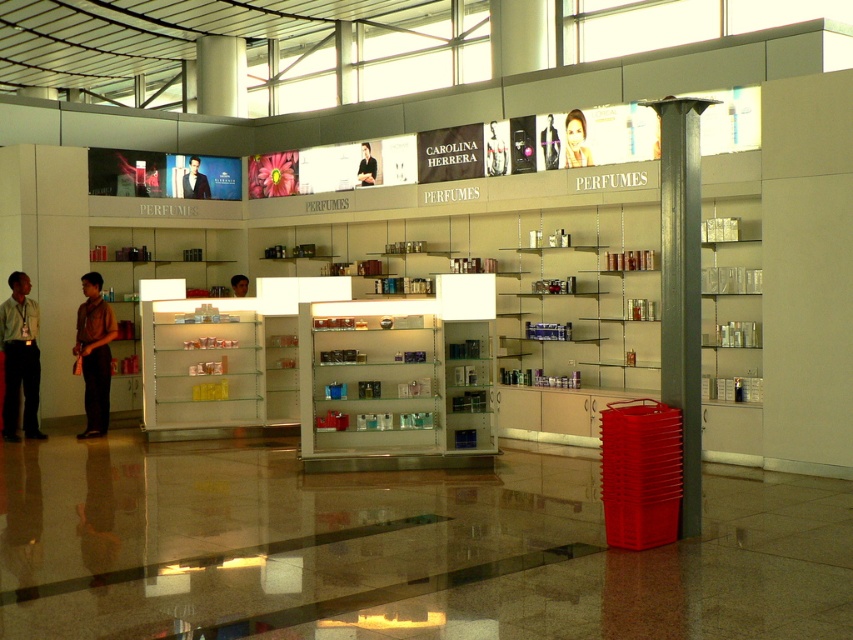
You are standing in the perfume shop and see a face at point (575, 140). What is the orientation of the face?

The smooth skin face at upper center is located at point (575, 140).

You are a customer in the perfume shop and want to find the matte black perfume at upper center. The shop has a grid system where each shelf is divided into sections labeled with coordinates. The perfume you want is located at point (495, 148). If the grid system uses the top left corner as the origin point, which section should you look in?

The matte black perfume at upper center is located at point (495, 148), so you should look in the section corresponding to those coordinates.